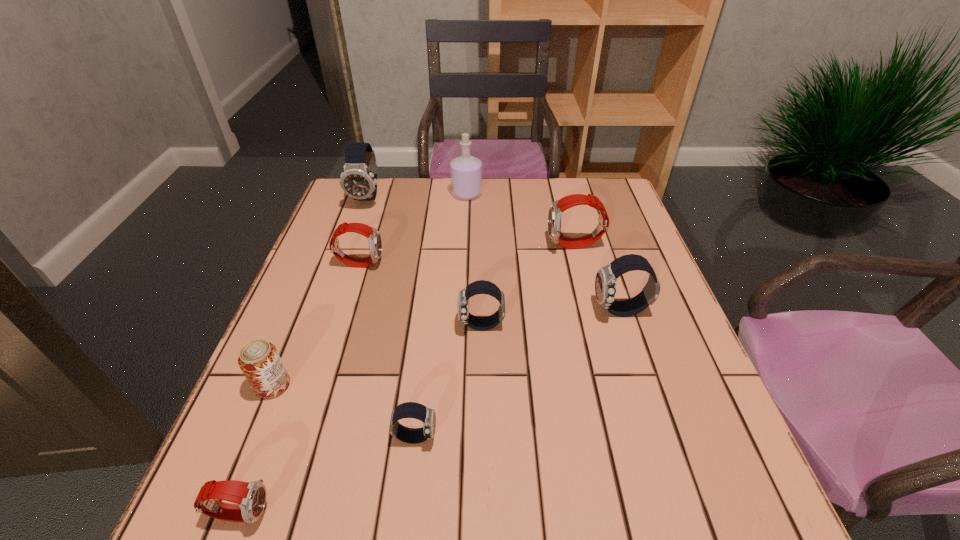
Where is `object that is at the near edge`? This screenshot has width=960, height=540. object that is at the near edge is located at coordinates (250, 497).

Locate an element on the screen. The image size is (960, 540). beer can located at the left edge is located at coordinates (259, 360).

Locate an element on the screen. The height and width of the screenshot is (540, 960). object situated at the far left corner is located at coordinates (358, 180).

Locate an element on the screen. The image size is (960, 540). object that is at the near left corner is located at coordinates (250, 497).

Find the location of a particular element. vacant position at the far edge of the desktop is located at coordinates (399, 212).

This screenshot has height=540, width=960. In order to click on vacant space at the near edge of the desktop in this screenshot , I will do `click(574, 499)`.

In the image, there is a desktop. Where is `free space at the left edge`? This screenshot has height=540, width=960. free space at the left edge is located at coordinates (332, 304).

Locate an element on the screen. vacant space at the right edge of the desktop is located at coordinates pos(631,237).

At what (x,y) coordinates should I click in order to perform the action: click on free area in between the nearest object and the rightmost red watch. Please return your answer as a coordinate pair (x, y). Image resolution: width=960 pixels, height=540 pixels. Looking at the image, I should click on (408, 379).

The width and height of the screenshot is (960, 540). I want to click on free spot between the beer can and the biggest dark watch, so click(x=321, y=292).